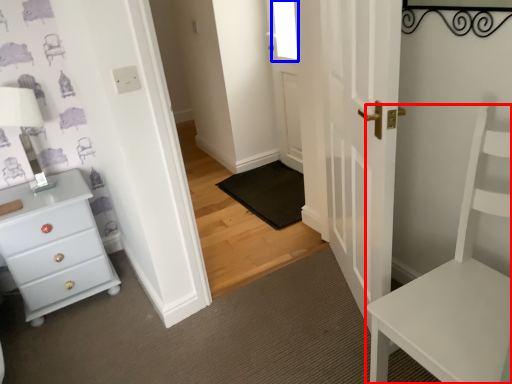
Question: Which point is further to the camera, furniture (highlighted by a red box) or window (highlighted by a blue box)?

Choices:
 (A) furniture
 (B) window

Answer: (B)